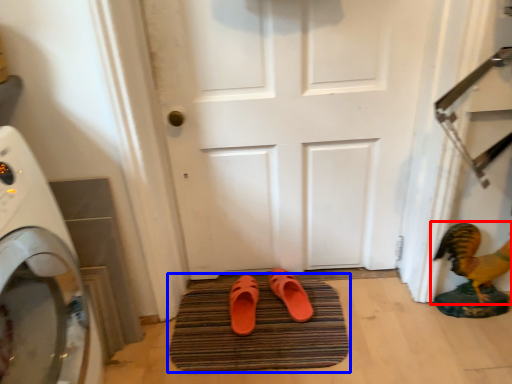
Question: Among these objects, which one is farthest to the camera, chicken (highlighted by a red box) or bath mat (highlighted by a blue box)?

Choices:
 (A) chicken
 (B) bath mat

Answer: (B)